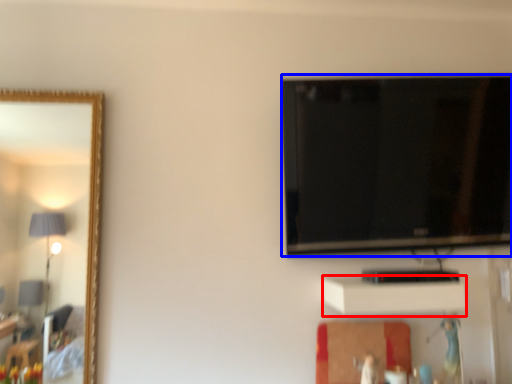
Question: Which object is closer to the camera taking this photo, cabinet (highlighted by a red box) or television (highlighted by a blue box)?

Choices:
 (A) cabinet
 (B) television

Answer: (A)